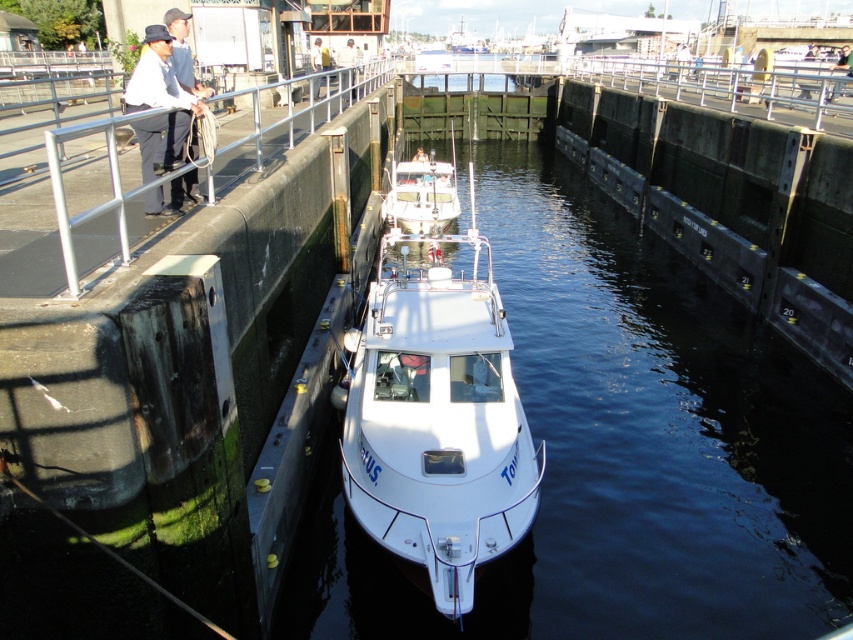
You are a photographer standing at the lock system. You want to take a photo of the white glossy boat at center without any obstructions. Is the matte black hat at upper left blocking the view of the boat?

The white glossy boat at center is positioned under the matte black hat at upper left, so the hat is blocking the view of the boat. To capture an unobstructed photo, you need to move to a position where the hat is no longer in front of the boat.

You are a photographer trying to capture a photo of the white glossy boat at center and the matte black hat at upper left in the same frame. Based on their sizes in the image, which object would appear larger in your photo?

The white glossy boat at center appears larger in the photo because it is taller than the matte black hat at upper left.

You are a photographer standing at the lock, wanting to capture a photo of the white cotton shirt at upper left and the white glossy water at center. Based on their positions, can you tell me which object is lower in the image?

The white glossy water at center is located below the white cotton shirt at upper left, so the white glossy water at center is lower in the image.